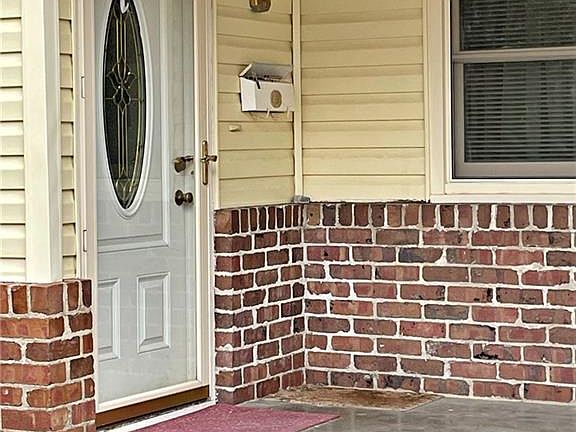
At what (x,y) coordinates should I click in order to perform the action: click on mat. Please return your answer as a coordinate pair (x, y). Looking at the image, I should click on (222, 419).